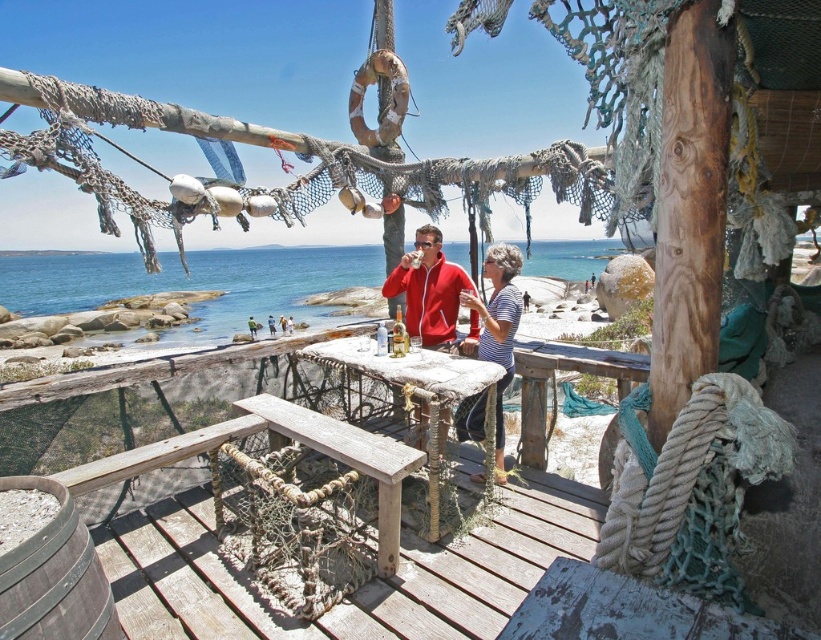
Question: Can you confirm if red fleece jacket at center is thinner than rustic wood picnic table at center?

Choices:
 (A) no
 (B) yes

Answer: (B)

Question: Which object is the closest to the red fleece jacket at center?

Choices:
 (A) striped fabric shirt at center
 (B) rustic wood picnic table at center

Answer: (A)

Question: Does striped fabric shirt at center come in front of wooden table at center?

Choices:
 (A) no
 (B) yes

Answer: (B)

Question: Considering the real-world distances, which object is closest to the striped fabric shirt at center?

Choices:
 (A) red fleece jacket at center
 (B) rustic wood picnic table at center
 (C) wooden bench at center
 (D) wooden table at center

Answer: (A)

Question: Among these points, which one is nearest to the camera?

Choices:
 (A) (461, 282)
 (B) (531, 401)
 (C) (423, 410)

Answer: (C)

Question: Is wooden bench at center positioned at the back of striped fabric shirt at center?

Choices:
 (A) yes
 (B) no

Answer: (B)